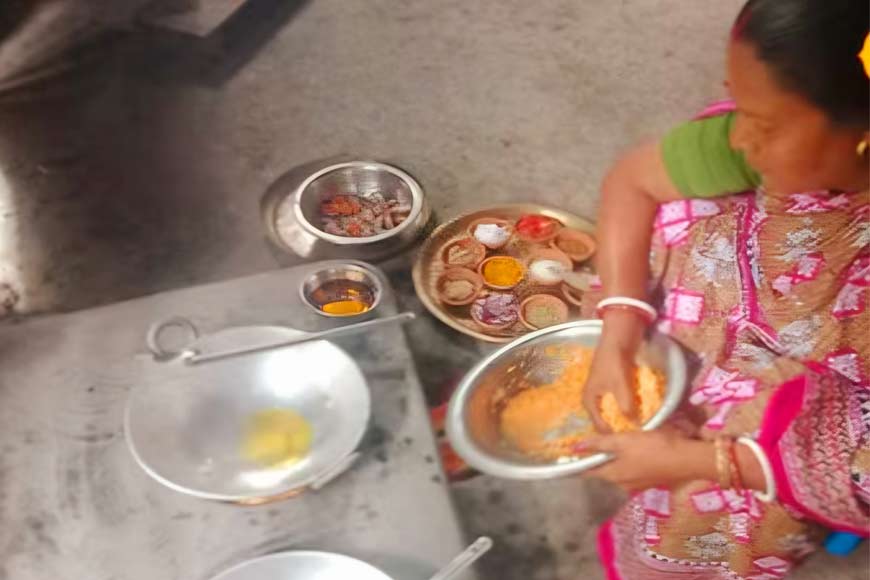
Image resolution: width=870 pixels, height=580 pixels. Find the location of `bowls`. bowls is located at coordinates (344, 191).